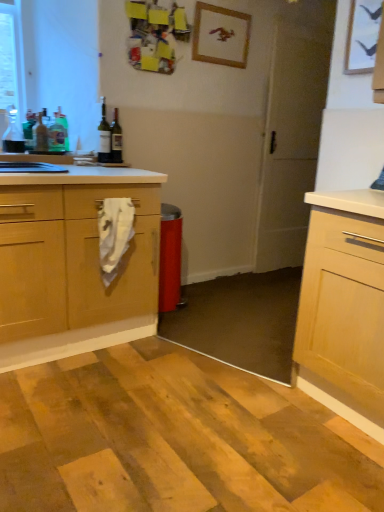
Question: From a real-world perspective, is green glass bottle at upper left, the 1th bottle viewed from the right, located higher than green glass bottle at upper left, the 3th bottle positioned from the left?

Choices:
 (A) no
 (B) yes

Answer: (A)

Question: Could you tell me if green glass bottle at upper left, which ranks as the sixth bottle in left-to-right order, is facing green glass bottle at upper left, the 4th bottle positioned from the right?

Choices:
 (A) no
 (B) yes

Answer: (A)

Question: Can you confirm if green glass bottle at upper left, the 1th bottle viewed from the right, is positioned to the left of green glass bottle at upper left, the 3th bottle positioned from the left?

Choices:
 (A) yes
 (B) no

Answer: (B)

Question: Considering the relative positions of green glass bottle at upper left, which ranks as the sixth bottle in left-to-right order, and green glass bottle at upper left, the 3th bottle positioned from the left, in the image provided, is green glass bottle at upper left, which ranks as the sixth bottle in left-to-right order, to the right of green glass bottle at upper left, the 3th bottle positioned from the left, from the viewer's perspective?

Choices:
 (A) yes
 (B) no

Answer: (A)

Question: Does green glass bottle at upper left, the 1th bottle viewed from the right, come behind green glass bottle at upper left, the 3th bottle positioned from the left?

Choices:
 (A) yes
 (B) no

Answer: (B)

Question: From their relative heights in the image, would you say matte glass bottle at upper left, marked as the 5th bottle in a left-to-right arrangement, is taller or shorter than translucent glass bottle at left, marked as the 2th bottle in a left-to-right arrangement?

Choices:
 (A) short
 (B) tall

Answer: (B)

Question: Is matte glass bottle at upper left, the 2th bottle viewed from the right, to the left or to the right of translucent glass bottle at left, arranged as the 5th bottle when viewed from the right, in the image?

Choices:
 (A) left
 (B) right

Answer: (B)

Question: Considering their positions, is matte glass bottle at upper left, marked as the 5th bottle in a left-to-right arrangement, located in front of or behind translucent glass bottle at left, arranged as the 5th bottle when viewed from the right?

Choices:
 (A) behind
 (B) front

Answer: (A)

Question: From the image's perspective, is matte glass bottle at upper left, marked as the 5th bottle in a left-to-right arrangement, above or below translucent glass bottle at left, arranged as the 5th bottle when viewed from the right?

Choices:
 (A) below
 (B) above

Answer: (B)

Question: Looking at their shapes, would you say matte glass bottle at upper left, marked as the 5th bottle in a left-to-right arrangement, is wider or thinner than green glass bottle at left, which is the 3th bottle from right to left?

Choices:
 (A) wide
 (B) thin

Answer: (A)

Question: From the image's perspective, is matte glass bottle at upper left, marked as the 5th bottle in a left-to-right arrangement, located above or below green glass bottle at left, which is the 3th bottle from right to left?

Choices:
 (A) above
 (B) below

Answer: (A)

Question: Is matte glass bottle at upper left, the 2th bottle viewed from the right, taller or shorter than green glass bottle at left, the fourth bottle viewed from the left?

Choices:
 (A) tall
 (B) short

Answer: (A)

Question: In the image, is matte glass bottle at upper left, the 2th bottle viewed from the right, positioned in front of or behind green glass bottle at left, which is the 3th bottle from right to left?

Choices:
 (A) front
 (B) behind

Answer: (A)

Question: Looking at their shapes, would you say white matte screen door at center is wider or thinner than wooden picture frame at upper center?

Choices:
 (A) thin
 (B) wide

Answer: (B)

Question: Is point (289, 253) closer or farther from the camera than point (213, 13)?

Choices:
 (A) closer
 (B) farther

Answer: (B)